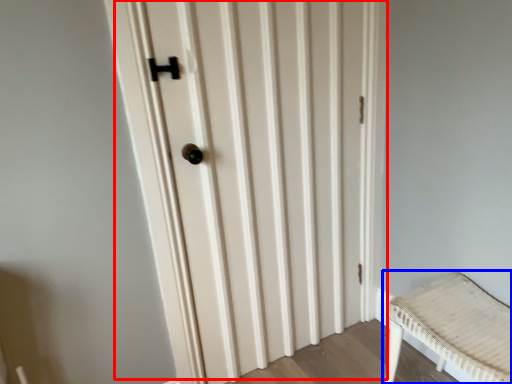
Question: Which object is closer to the camera taking this photo, door (highlighted by a red box) or furniture (highlighted by a blue box)?

Choices:
 (A) door
 (B) furniture

Answer: (B)